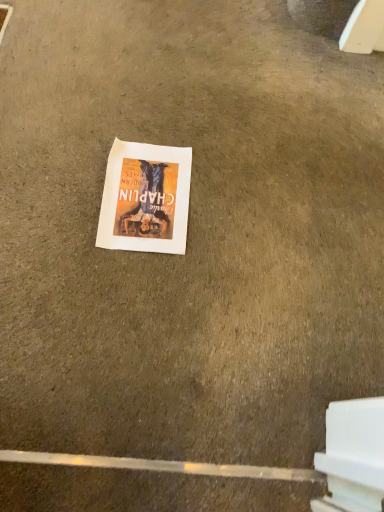
The width and height of the screenshot is (384, 512). Describe the element at coordinates (145, 198) in the screenshot. I see `white paper poster at center` at that location.

The width and height of the screenshot is (384, 512). Find the location of `white paper poster at center`. white paper poster at center is located at coordinates (145, 198).

I want to click on white paper poster at center, so click(x=145, y=198).